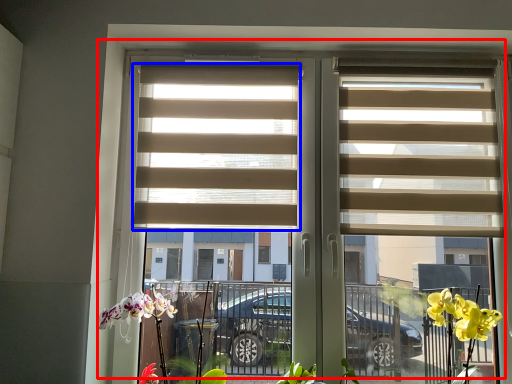
Question: Among these objects, which one is nearest to the camera, window (highlighted by a red box) or window blind (highlighted by a blue box)?

Choices:
 (A) window
 (B) window blind

Answer: (A)